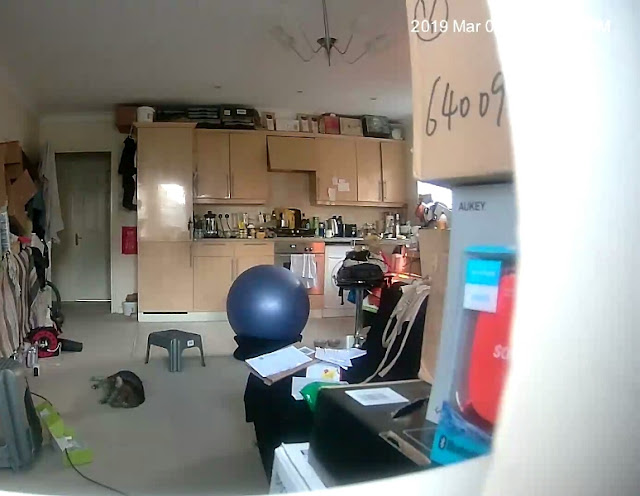
You are a GUI agent. You are given a task and a screenshot of the screen. Output one action in this format:
    pyautogui.click(x=<x>, y=<y>)
    Task: Click on the gray empty floor space
    
    Given the screenshot: What is the action you would take?
    pyautogui.click(x=182, y=474), pyautogui.click(x=178, y=405), pyautogui.click(x=102, y=331)